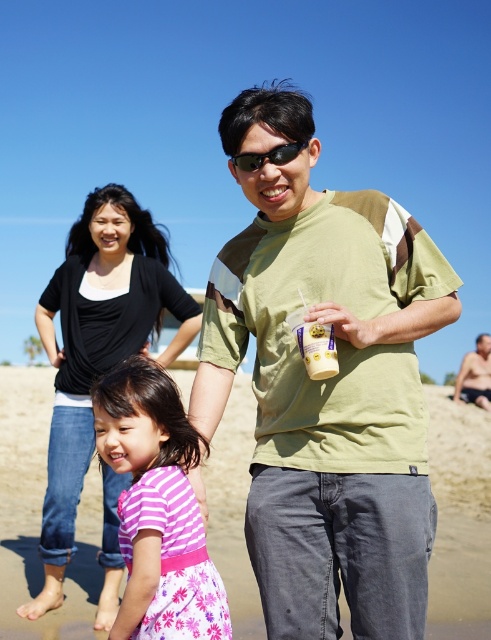
You are a photographer taking a picture of the beach scene. You notice two people wearing different clothes. Which clothing item is larger in size between the black cotton shirt at upper left and the pink floral dress at center?

The black cotton shirt at upper left is bigger than the pink floral dress at center.

You are a photographer taking a picture of the beach scene. You notice the black cotton shirt at upper left and the black plastic sunglasses at center. Which object is closer to the bottom of the image?

The black cotton shirt at upper left is positioned under the black plastic sunglasses at center, so the black cotton shirt at upper left is closer to the bottom of the image.